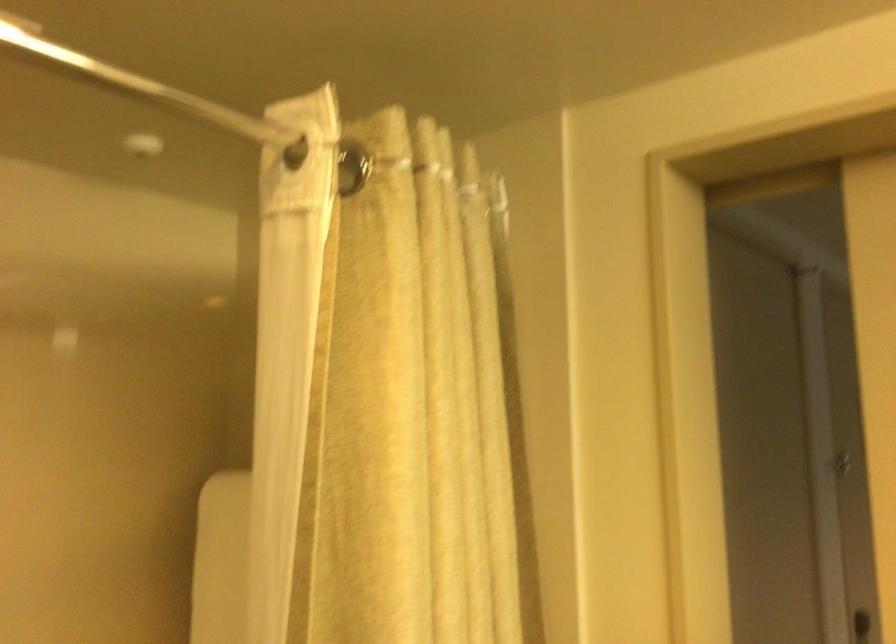
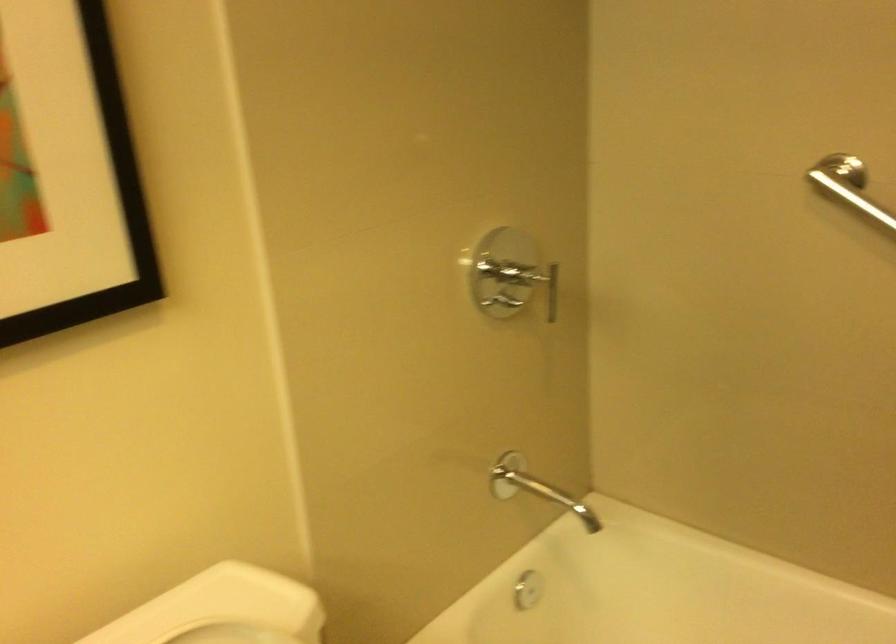
How did the camera likely rotate?

The camera's rotation is toward left-down.